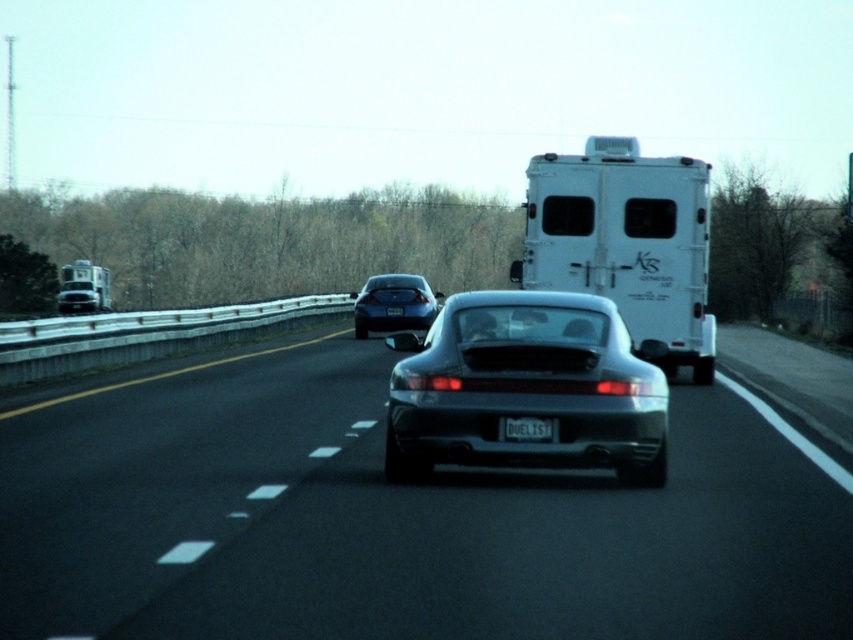
You are driving a car and want to overtake the satin black car at center on this highway. Based on the scene description, can you safely pass the car on the left side where the guardrail is present?

The satin black car at center is located at point (525, 388), which indicates its position relative to the guardrail. Since the guardrail is on the left side of the road, overtaking on that side would be unsafe due to the barrier. You should consider passing on the right side if allowed by traffic rules.